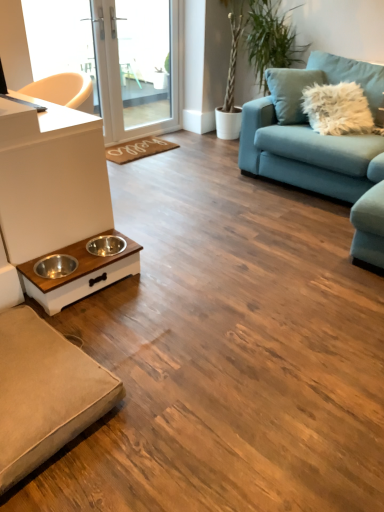
Locate an element on the screen. Image resolution: width=384 pixels, height=512 pixels. free space in front of white wood pet feeder at lower left is located at coordinates (109, 324).